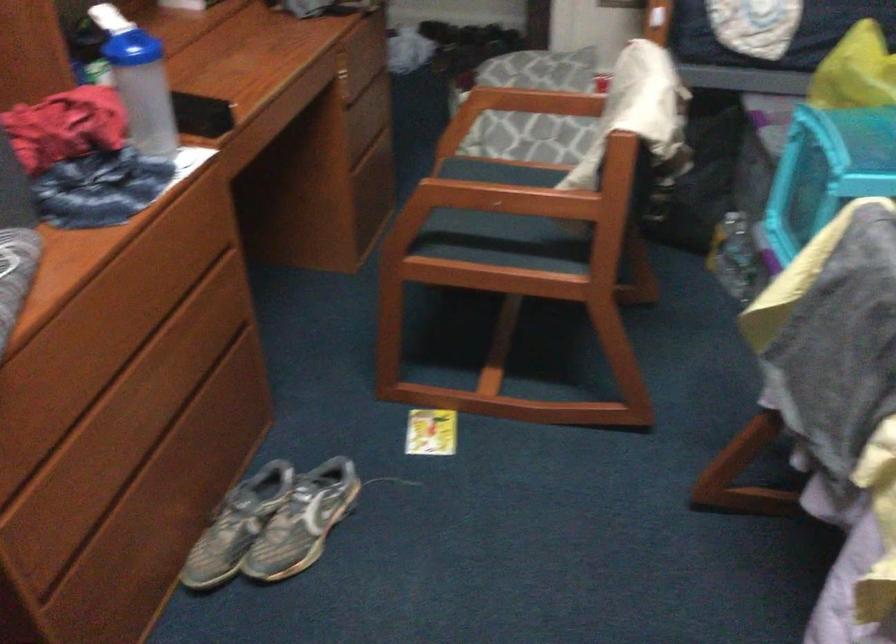
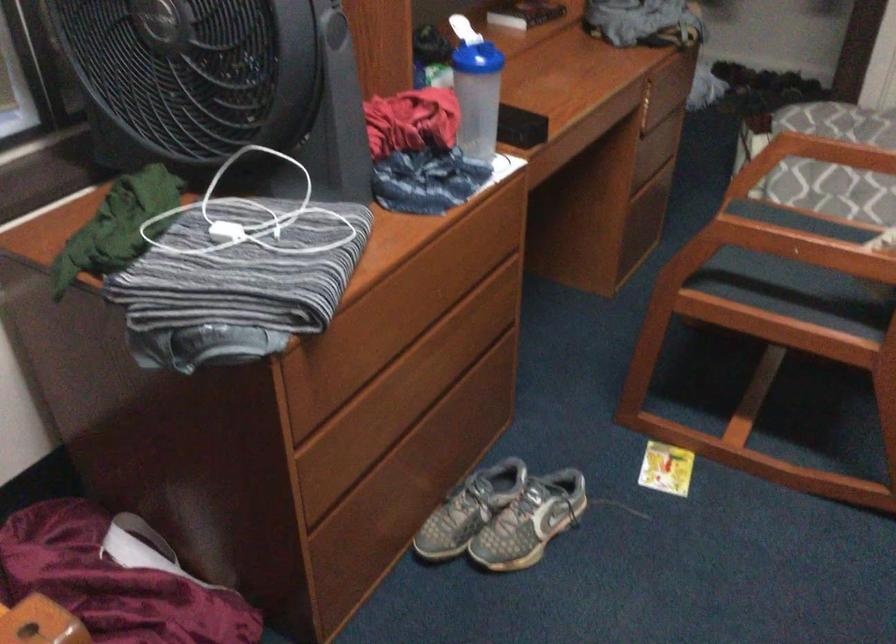
The point at (359, 142) is marked in the first image. Where is the corresponding point in the second image?

(643, 169)